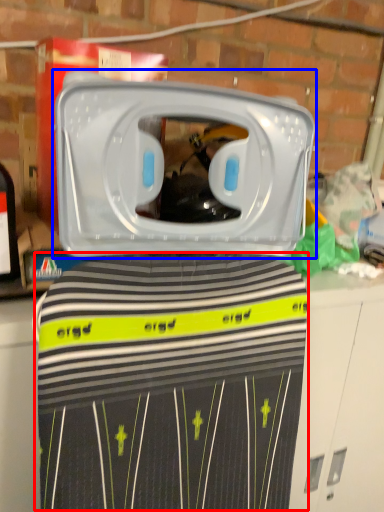
Question: Which point is closer to the camera, clothing (highlighted by a red box) or home appliance (highlighted by a blue box)?

Choices:
 (A) clothing
 (B) home appliance

Answer: (B)